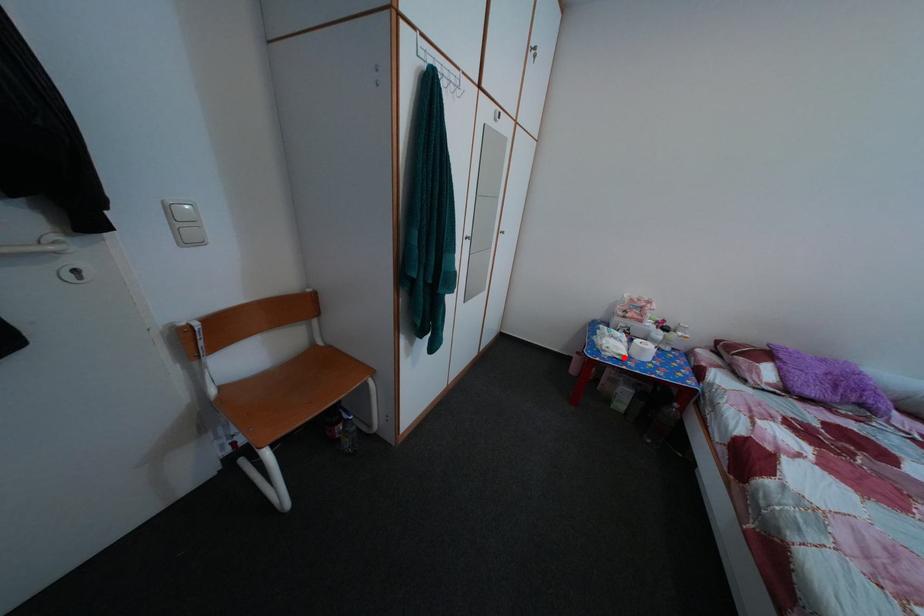
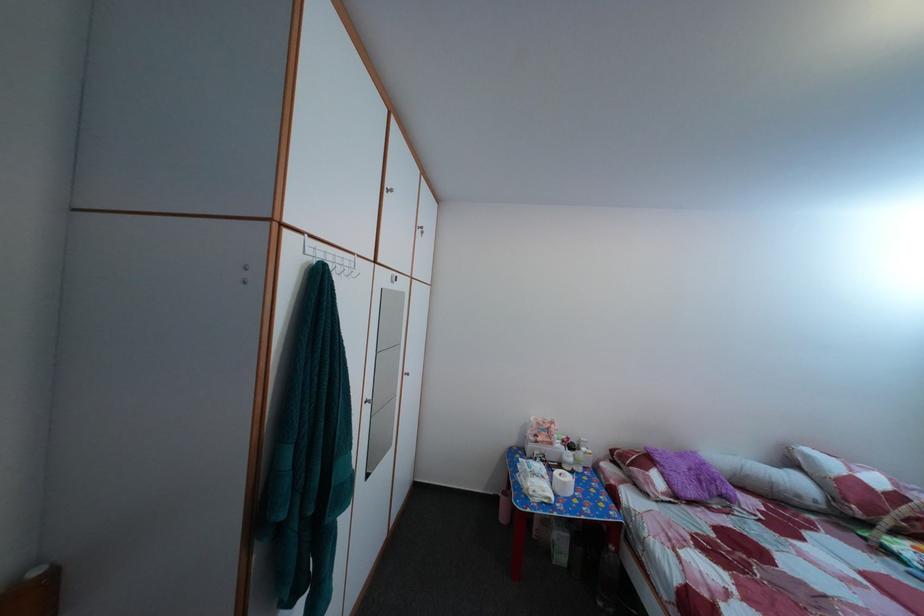
Find the pixel in the second image that matches the highlighted location in the first image.

(551, 500)